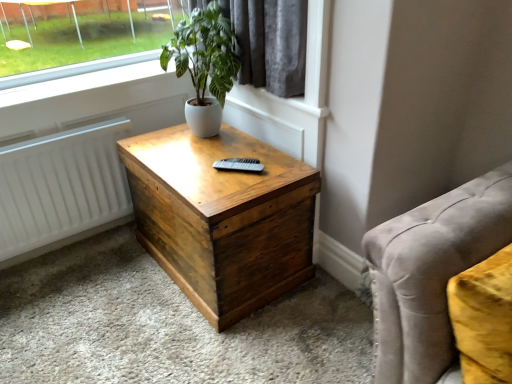
Question: Is green leafy plant at upper center further to the viewer compared to wooden nightstand at center?

Choices:
 (A) yes
 (B) no

Answer: (A)

Question: Can you see green leafy plant at upper center touching wooden nightstand at center?

Choices:
 (A) yes
 (B) no

Answer: (B)

Question: Does green leafy plant at upper center have a larger size compared to wooden nightstand at center?

Choices:
 (A) yes
 (B) no

Answer: (B)

Question: Is green leafy plant at upper center shorter than wooden nightstand at center?

Choices:
 (A) no
 (B) yes

Answer: (B)

Question: From the image's perspective, would you say green leafy plant at upper center is shown under wooden nightstand at center?

Choices:
 (A) yes
 (B) no

Answer: (B)

Question: Are green leafy plant at upper center and wooden nightstand at center located far from each other?

Choices:
 (A) yes
 (B) no

Answer: (B)

Question: Can velvet gray studio couch at lower right be found inside wooden nightstand at center?

Choices:
 (A) no
 (B) yes

Answer: (A)

Question: Are wooden nightstand at center and velvet gray studio couch at lower right located far from each other?

Choices:
 (A) yes
 (B) no

Answer: (B)

Question: Is wooden nightstand at center turned away from velvet gray studio couch at lower right?

Choices:
 (A) no
 (B) yes

Answer: (A)

Question: Is wooden nightstand at center next to velvet gray studio couch at lower right and touching it?

Choices:
 (A) yes
 (B) no

Answer: (B)

Question: Is wooden nightstand at center wider than velvet gray studio couch at lower right?

Choices:
 (A) no
 (B) yes

Answer: (B)

Question: Does wooden nightstand at center appear on the left side of velvet gray studio couch at lower right?

Choices:
 (A) no
 (B) yes

Answer: (B)

Question: Is wooden nightstand at center further to camera compared to white matte radiator at left?

Choices:
 (A) yes
 (B) no

Answer: (B)